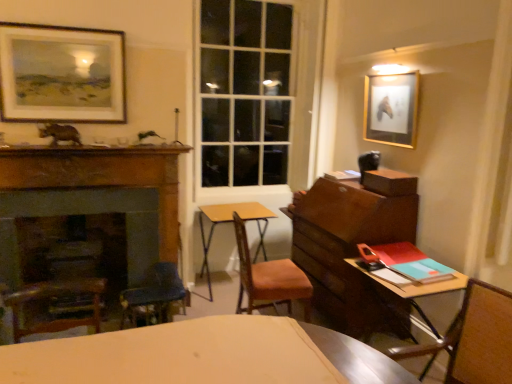
Question: Does teal matte book at right have a greater width compared to yellow wood table at center, which appears as the 2th table when viewed from the right?

Choices:
 (A) yes
 (B) no

Answer: (B)

Question: Can you confirm if teal matte book at right is thinner than yellow wood table at center, which appears as the 2th table when viewed from the right?

Choices:
 (A) no
 (B) yes

Answer: (B)

Question: Is teal matte book at right positioned beyond the bounds of yellow wood table at center, the 1th table positioned from the back?

Choices:
 (A) yes
 (B) no

Answer: (A)

Question: Is teal matte book at right at the right side of yellow wood table at center, the first table from the left?

Choices:
 (A) yes
 (B) no

Answer: (A)

Question: Can you confirm if teal matte book at right is taller than yellow wood table at center, the first table from the left?

Choices:
 (A) yes
 (B) no

Answer: (B)

Question: Considering the positions of teal matte book at right and wooden chair at right, arranged as the 2th chair when viewed from the left, in the image, is teal matte book at right taller or shorter than wooden chair at right, arranged as the 2th chair when viewed from the left,?

Choices:
 (A) tall
 (B) short

Answer: (B)

Question: Is point (434, 259) closer or farther from the camera than point (479, 332)?

Choices:
 (A) farther
 (B) closer

Answer: (A)

Question: Is teal matte book at right in front of or behind wooden chair at right, arranged as the 2th chair when viewed from the left, in the image?

Choices:
 (A) behind
 (B) front

Answer: (A)

Question: From the image's perspective, relative to wooden chair at right, arranged as the first chair when viewed from the front, is teal matte book at right above or below?

Choices:
 (A) below
 (B) above

Answer: (B)

Question: Would you say wooden desk at right, which ranks as the second table in left-to-right order, is inside or outside teal matte book at right?

Choices:
 (A) outside
 (B) inside

Answer: (A)

Question: From their relative heights in the image, would you say wooden desk at right, which is the 2th table from back to front, is taller or shorter than teal matte book at right?

Choices:
 (A) short
 (B) tall

Answer: (B)

Question: Considering the positions of wooden desk at right, which is the first table in front-to-back order, and teal matte book at right in the image, is wooden desk at right, which is the first table in front-to-back order, bigger or smaller than teal matte book at right?

Choices:
 (A) big
 (B) small

Answer: (A)

Question: From a real-world perspective, relative to teal matte book at right, is wooden desk at right, which is the 2th table from back to front, vertically above or below?

Choices:
 (A) below
 (B) above

Answer: (A)

Question: From the image's perspective, relative to wooden fireplace at left, is teal matte book at right above or below?

Choices:
 (A) above
 (B) below

Answer: (B)

Question: From a real-world perspective, is teal matte book at right physically located above or below wooden fireplace at left?

Choices:
 (A) below
 (B) above

Answer: (B)